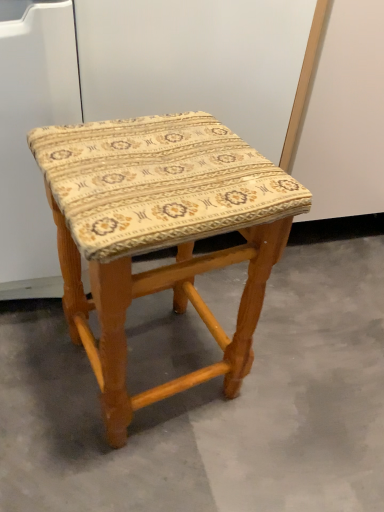
Question: In terms of size, does wooden stool at center appear bigger or smaller than beige fabric stool at center?

Choices:
 (A) small
 (B) big

Answer: (B)

Question: In terms of height, does wooden stool at center look taller or shorter compared to beige fabric stool at center?

Choices:
 (A) tall
 (B) short

Answer: (A)

Question: Looking at their shapes, would you say wooden stool at center is wider or thinner than beige fabric stool at center?

Choices:
 (A) thin
 (B) wide

Answer: (A)

Question: Considering the positions of beige fabric stool at center and wooden stool at center in the image, is beige fabric stool at center taller or shorter than wooden stool at center?

Choices:
 (A) tall
 (B) short

Answer: (B)

Question: Considering the positions of beige fabric stool at center and wooden stool at center in the image, is beige fabric stool at center wider or thinner than wooden stool at center?

Choices:
 (A) wide
 (B) thin

Answer: (A)

Question: Considering the positions of beige fabric stool at center and wooden stool at center in the image, is beige fabric stool at center bigger or smaller than wooden stool at center?

Choices:
 (A) big
 (B) small

Answer: (B)

Question: From a real-world perspective, is beige fabric stool at center physically located above or below wooden stool at center?

Choices:
 (A) below
 (B) above

Answer: (A)